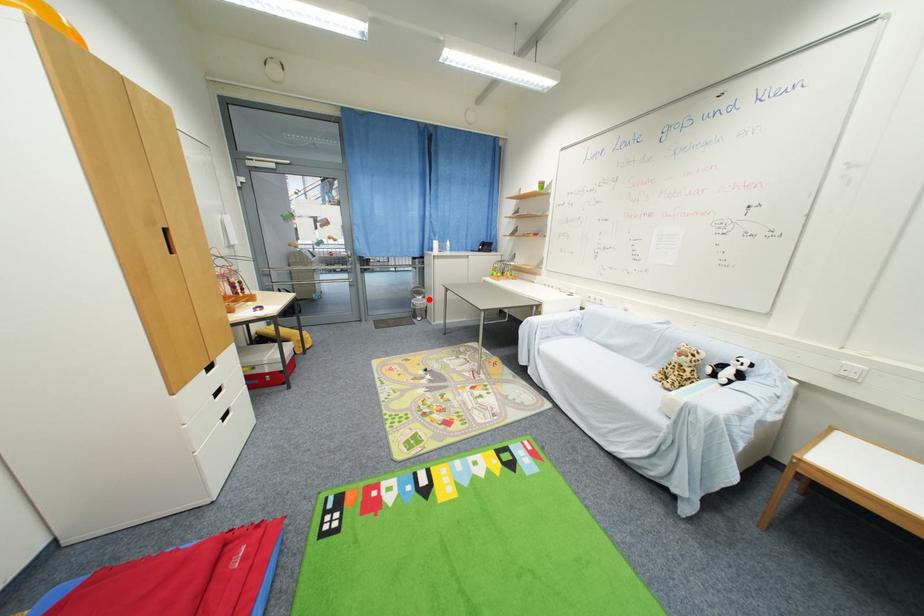
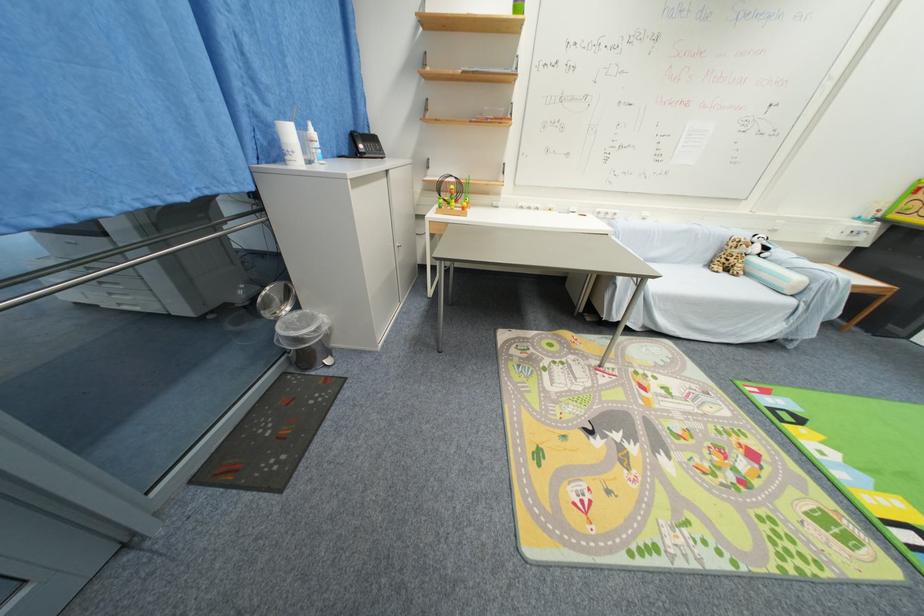
Question: I am providing you with two images of the same scene from different viewpoints. In image1, a red point is highlighted. Considering the same 3D point in image2, which of the following is correct?

Choices:
 (A) It is closer
 (B) It is farther

Answer: (A)